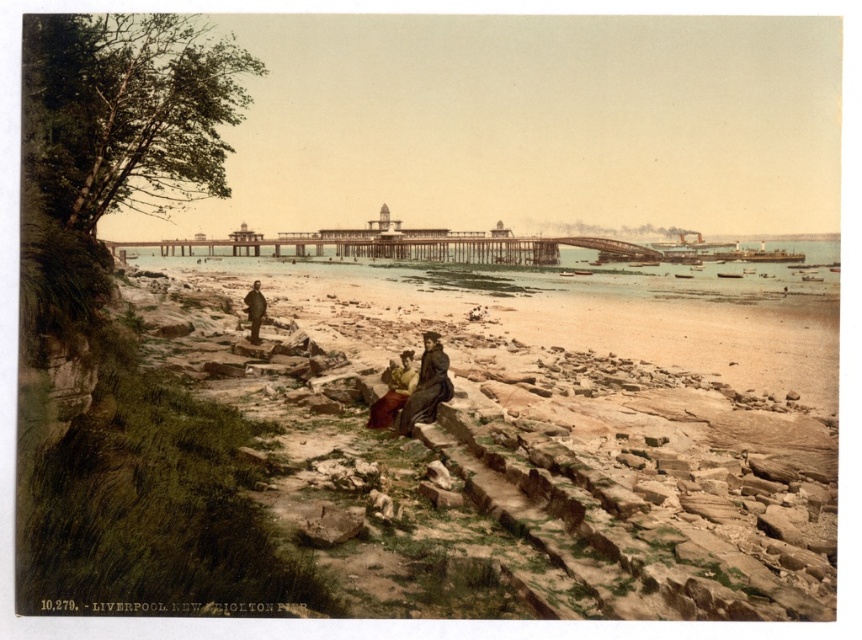
You are a photographer planning to take a landscape shot of the smooth sand beach at lower center and the clear water at center. You want to ensure the two elements are in focus simultaneously. Given that your camera can only maintain sharp focus within a 100 meter range, will you be able to achieve this?

The distance between the smooth sand beach at lower center and the clear water at center is 139.83 meters, which exceeds the camera focus range of 100 meters. Therefore, it will be difficult to keep both in focus at the same time.

You are a photographer standing at the edge of the pier and want to capture both the clear water at center and the dark brown leather coat at center in your photo. Which object will appear closer to the camera in the final image?

The clear water at center appears closer to the camera in the final image because it is further to the viewer than the dark brown leather coat at center.

You are a photographer trying to capture a photo of the two people in the center of the image. The subjects are wearing a matte yellow dress at center and a dark brown leather coat at center. Which subject is standing more to the right side?

The matte yellow dress at center is positioned on the right side of dark brown leather coat at center, so the person wearing the matte yellow dress at center is standing more to the right side.